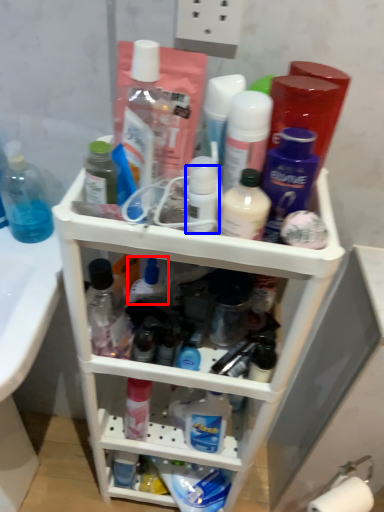
Question: Which object appears farthest to the camera in this image, toiletry (highlighted by a red box) or toiletry (highlighted by a blue box)?

Choices:
 (A) toiletry
 (B) toiletry

Answer: (A)